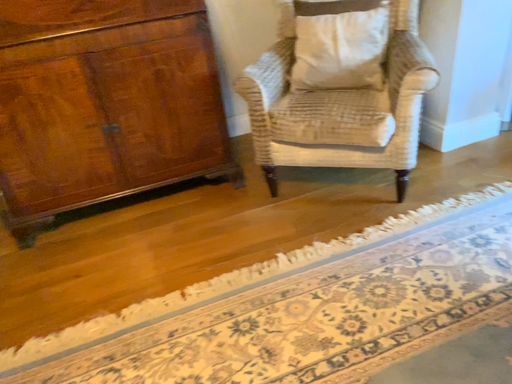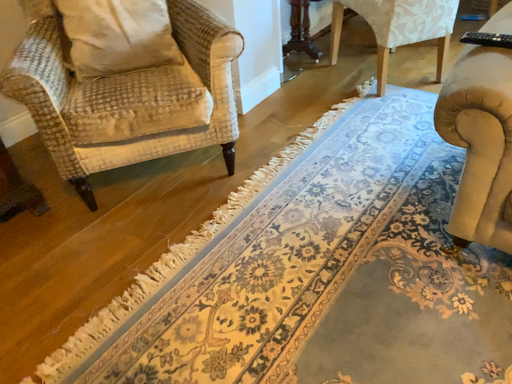
Question: Which way did the camera rotate in the video?

Choices:
 (A) rotated left
 (B) rotated right

Answer: (B)